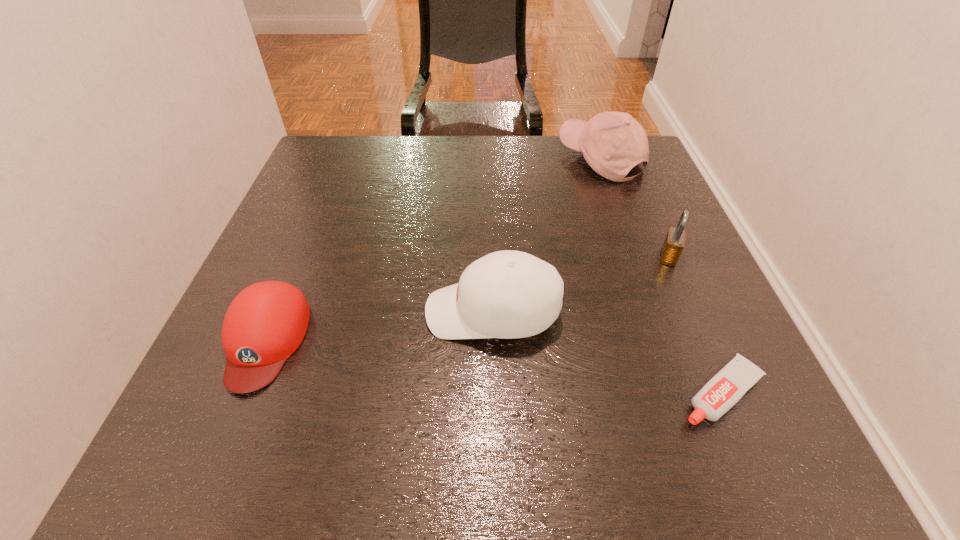
You are a GUI agent. You are given a task and a screenshot of the screen. Output one action in this format:
    pyautogui.click(x=<x>, y=<y>)
    Task: Click on the farthest baseball cap
    The image size is (960, 540).
    Given the screenshot: What is the action you would take?
    pyautogui.click(x=612, y=143)

Where is `the farthest object`? This screenshot has height=540, width=960. the farthest object is located at coordinates (612, 143).

Identify the location of the second object from left to right. (507, 294).

Where is `the second farthest object`? The width and height of the screenshot is (960, 540). the second farthest object is located at coordinates (x=674, y=242).

At what (x,y) coordinates should I click in order to perform the action: click on the leftmost object. Please return your answer as a coordinate pair (x, y). Looking at the image, I should click on click(x=265, y=324).

In order to click on the second shortest object in this screenshot , I will do `click(265, 324)`.

Where is `toothpaste`? This screenshot has width=960, height=540. toothpaste is located at coordinates (727, 387).

Find the location of `vacant space positioned 0.080m on the front-facing side of the farthest baseball cap`. vacant space positioned 0.080m on the front-facing side of the farthest baseball cap is located at coordinates (531, 159).

This screenshot has width=960, height=540. Find the location of `vacant space located on the front-facing side of the farthest baseball cap`. vacant space located on the front-facing side of the farthest baseball cap is located at coordinates (476, 159).

Locate an element on the screen. vacant space located on the front-facing side of the farthest baseball cap is located at coordinates (531, 159).